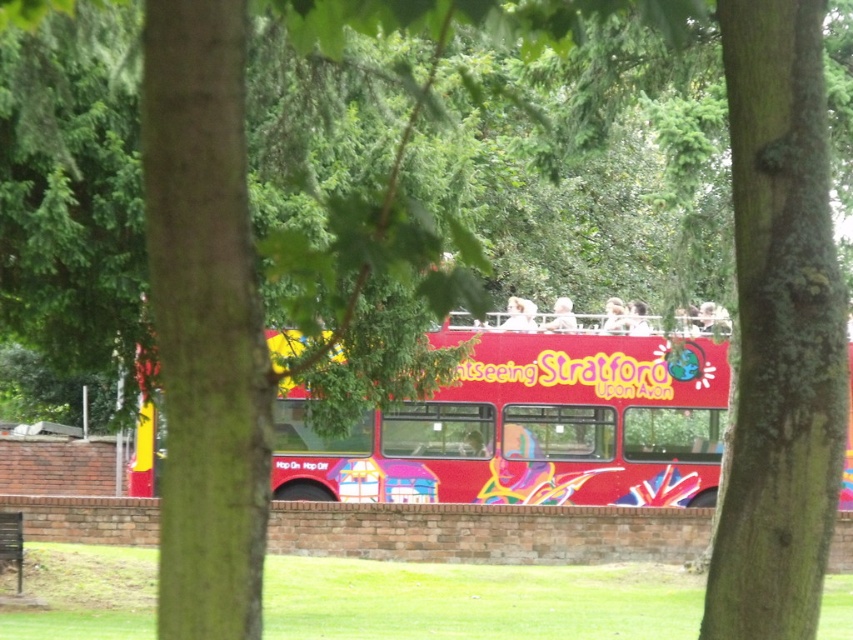
Describe the element at coordinates (778, 330) in the screenshot. I see `green rough bark tree at center` at that location.

Which is in front, point (770, 42) or point (695, 486)?

Positioned in front is point (770, 42).

Who is more distant from viewer, (804, 636) or (521, 372)?

The point (521, 372) is behind.

Where is `green rough bark tree at center`? This screenshot has width=853, height=640. green rough bark tree at center is located at coordinates (778, 330).